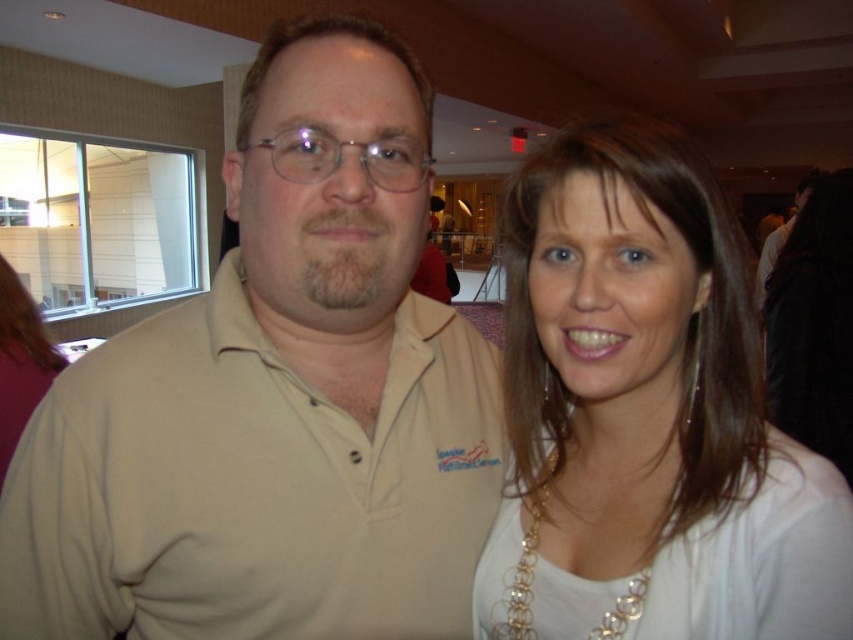
Who is positioned more to the right, beige cotton polo shirt at center or white fabric at upper right?

white fabric at upper right is more to the right.

Between beige cotton polo shirt at center and white fabric at upper right, which one is positioned higher?

Positioned higher is beige cotton polo shirt at center.

Between point (288, 492) and point (517, 620), which one is positioned in front?

Point (288, 492) is more forward.

This screenshot has height=640, width=853. Find the location of `beige cotton polo shirt at center`. beige cotton polo shirt at center is located at coordinates (276, 397).